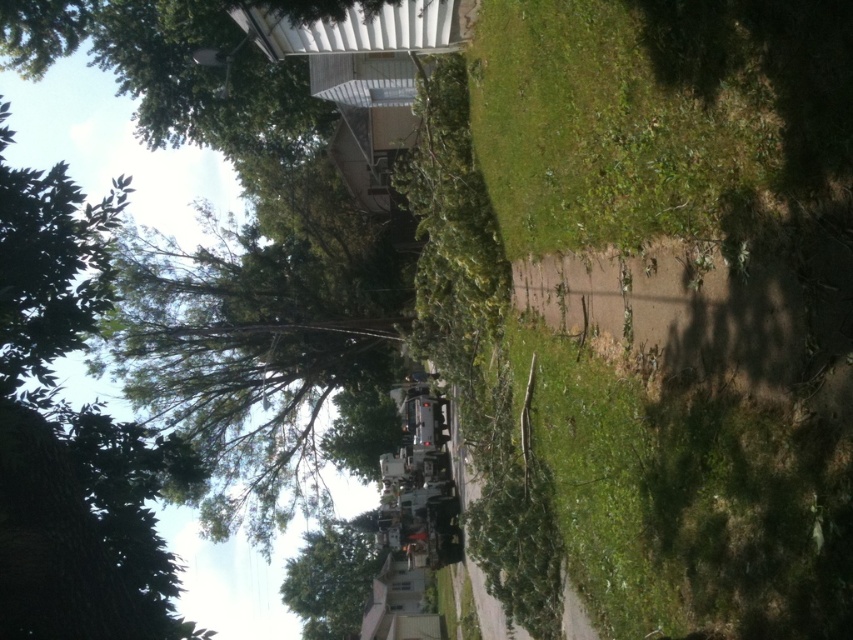
Does green leafy tree at upper left appear on the left side of green leafy tree at lower center?

Correct, you'll find green leafy tree at upper left to the left of green leafy tree at lower center.

Can you confirm if green leafy tree at upper left is positioned below green leafy tree at lower center?

No, green leafy tree at upper left is not below green leafy tree at lower center.

Between point (373, 317) and point (357, 516), which one is positioned behind?

The point (357, 516) is behind.

Find the location of a particular element. This screenshot has width=853, height=640. green leafy tree at upper left is located at coordinates (259, 336).

Is green grass at center shorter than green leafy tree at upper left?

Correct, green grass at center is not as tall as green leafy tree at upper left.

The width and height of the screenshot is (853, 640). Describe the element at coordinates (683, 156) in the screenshot. I see `green grass at center` at that location.

The height and width of the screenshot is (640, 853). What are the coordinates of `green grass at center` in the screenshot? It's located at (683, 156).

Does green grass at center have a greater width compared to green leafy tree at lower center?

No, green grass at center is not wider than green leafy tree at lower center.

Is point (824, 484) positioned behind point (364, 593)?

No, it is not.

Is point (695, 451) closer to camera compared to point (303, 573)?

Yes, point (695, 451) is in front of point (303, 573).

The width and height of the screenshot is (853, 640). In order to click on green grass at center in this screenshot , I will do `click(683, 156)`.